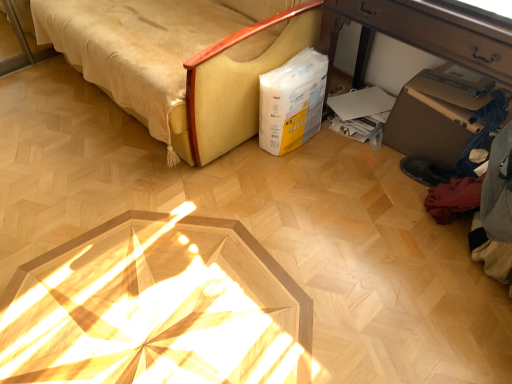
The height and width of the screenshot is (384, 512). Find the location of `empty space that is to the right of white paper bag at center-right`. empty space that is to the right of white paper bag at center-right is located at coordinates (335, 147).